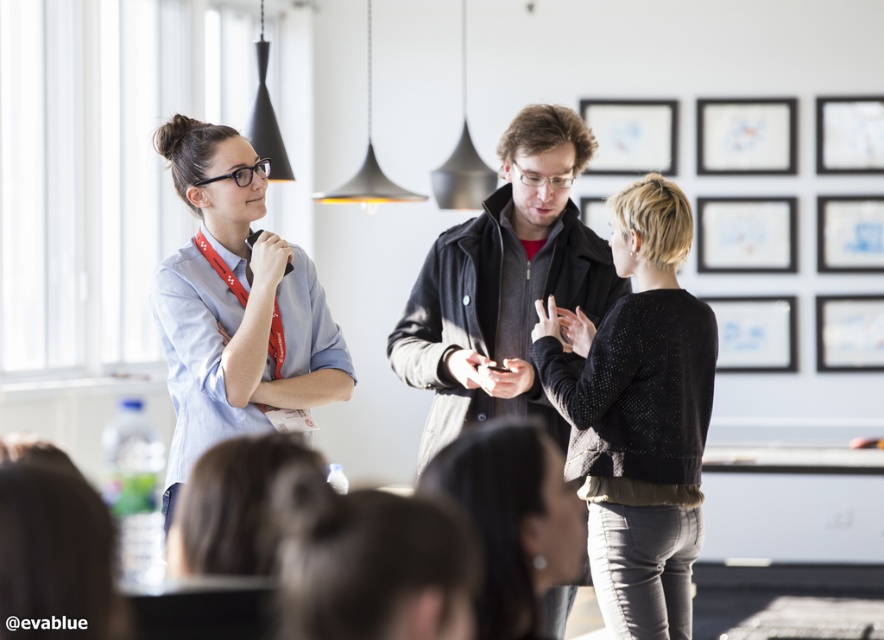
You are a photographer positioned at the back of the room. You want to take a photo that includes both the light blue shirt at center and the dark gray jacket at center. Based on their positions, which one will appear larger in the photo?

The light blue shirt at center will appear larger in the photo because it is much taller than the dark gray jacket at center.

You are organizing a photo shoot and need to ensure that the black textured sweater at center and dark gray jacket at center are visible in the frame. Given their sizes, which one might require more space vertically to be fully captured?

The black textured sweater at center has a greater height compared to the dark gray jacket at center, so it would require more vertical space to be fully captured in the photo shoot.